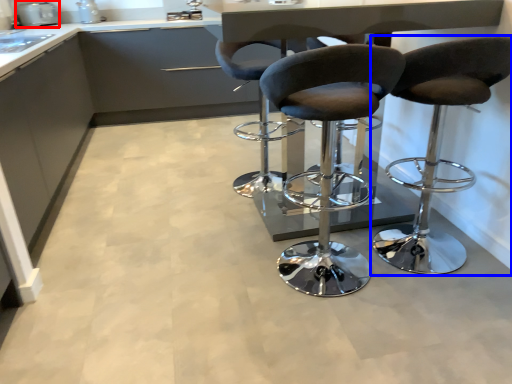
Question: Which point is further to the camera, appliance (highlighted by a red box) or chair (highlighted by a blue box)?

Choices:
 (A) appliance
 (B) chair

Answer: (A)